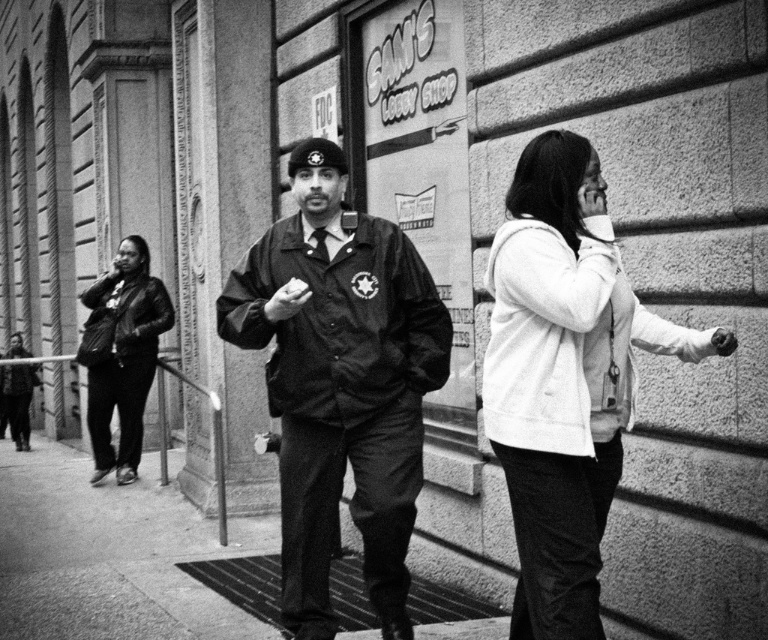
The width and height of the screenshot is (768, 640). What are the coordinates of `white matte jacket at center` in the screenshot? It's located at pyautogui.click(x=563, y=378).

Is point (541, 380) farther from camera compared to point (138, 456)?

No, it is in front of (138, 456).

Is point (631, 310) positioned before point (151, 342)?

Yes, point (631, 310) is in front of point (151, 342).

Locate an element on the screen. The width and height of the screenshot is (768, 640). white matte jacket at center is located at coordinates (563, 378).

This screenshot has height=640, width=768. Describe the element at coordinates (563, 378) in the screenshot. I see `white matte jacket at center` at that location.

Based on the photo, which is more to the left, white matte jacket at center or smooth concrete sidewalk at center?

smooth concrete sidewalk at center is more to the left.

Does point (636, 305) come farther from viewer compared to point (151, 500)?

That is False.

The width and height of the screenshot is (768, 640). I want to click on white matte jacket at center, so click(x=563, y=378).

Which is in front, point (315, 321) or point (108, 412)?

Positioned in front is point (315, 321).

Does matte black uniform at center have a smaller size compared to leather jacket at left?

Indeed, matte black uniform at center has a smaller size compared to leather jacket at left.

Is point (300, 310) behind point (128, 317)?

No, it is in front of (128, 317).

Image resolution: width=768 pixels, height=640 pixels. I want to click on matte black uniform at center, so click(x=339, y=381).